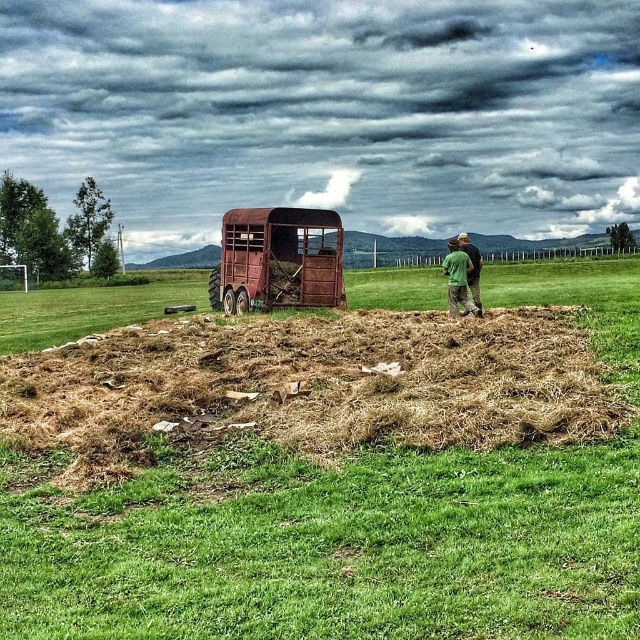
You are a farmer trying to load more hay onto the trailer. The trailer can only hold items narrower than the green fabric shirt at upper right. Can the brown dry hay at center fit on the trailer?

The brown dry hay at center has a width larger than the green fabric shirt at upper right, so it cannot fit on the trailer since the trailer can only hold items narrower than the green fabric shirt at upper right.